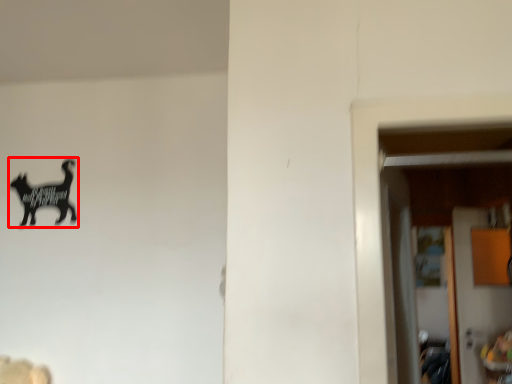
Question: In this image, where is animal (annotated by the red box) located relative to door?

Choices:
 (A) left
 (B) right

Answer: (A)